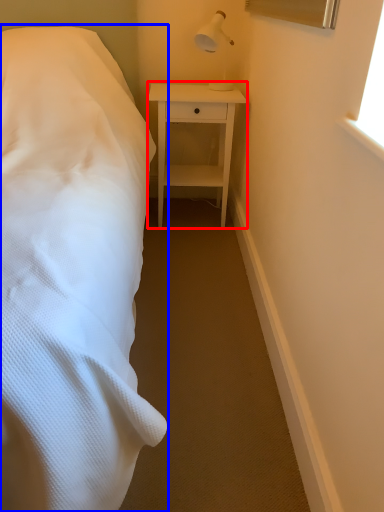
Question: Which point is closer to the camera, nightstand (highlighted by a red box) or bed (highlighted by a blue box)?

Choices:
 (A) nightstand
 (B) bed

Answer: (B)